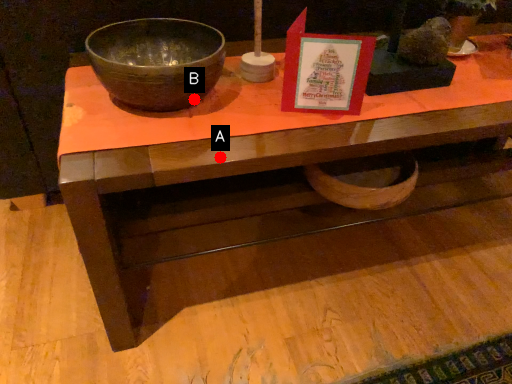
Question: Two points are circled on the image, labeled by A and B beside each circle. Among these points, which one is nearest to the camera?

Choices:
 (A) A is closer
 (B) B is closer

Answer: (A)